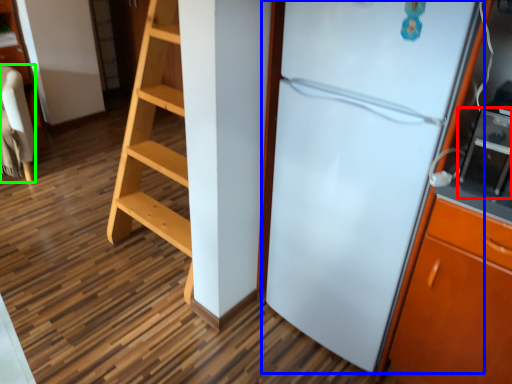
Question: Considering the real-world distances, which object is closest to appliance (highlighted by a red box)? refrigerator (highlighted by a blue box) or furniture (highlighted by a green box).

Choices:
 (A) refrigerator
 (B) furniture

Answer: (A)